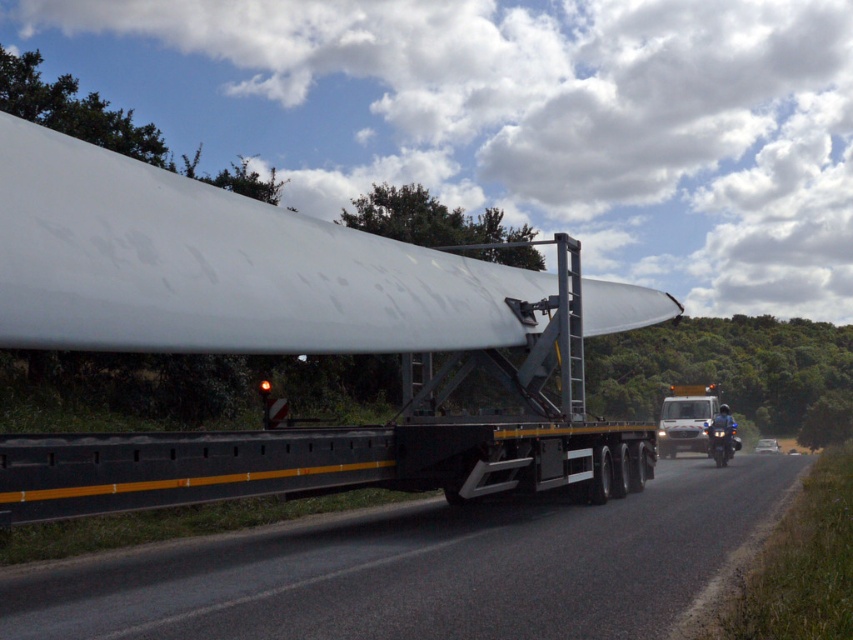
Consider the image. You are a delivery driver transporting the white matte wind turbine blade at center on a flatbed trailer. The GPS shows that you need to pass under a bridge with a clearance height of 4.5 meters. The point at coordinates point (288, 339) on the blade is exactly at the height of the bridge. Can you safely pass under the bridge without hitting it?

The point at coordinates point (288, 339) on the white matte wind turbine blade at center is exactly at the height of the bridge. Since the blade is the highest point of the trailer, and the bridge has a clearance of 4.5 meters, the delivery driver can safely pass under the bridge as long as the blade does not exceed the 4.5 meters height at that point. However, the exact height of the blade at that coordinate is not provided, so it is recommended to measure or confirm the blade height at point 0.531, 0.3

You are a traffic officer planning to inspect the white matte wind turbine blade at center. Where exactly is the blade positioned on the trailer according to the coordinates provided?

The white matte wind turbine blade at center is located at point (288,339).

You are a truck driver transporting the white matte wind turbine blade at center on a black asphalt road at center. You notice that the blade is taller than the road. How does this affect your driving route?

The white matte wind turbine blade at center is much taller than the black asphalt road at center, so you need to avoid low bridges or overhead obstacles that might be in your path to prevent the blade from colliding with them.